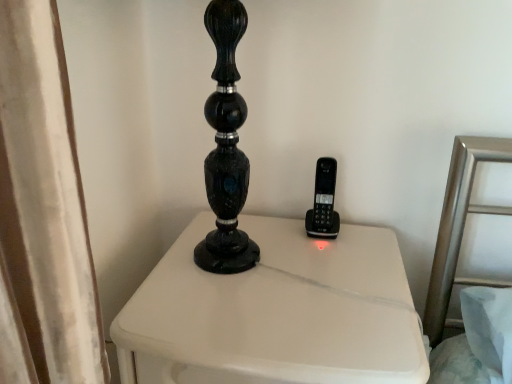
The width and height of the screenshot is (512, 384). In order to click on free point in front of black plastic phone at center in this screenshot , I will do `click(329, 261)`.